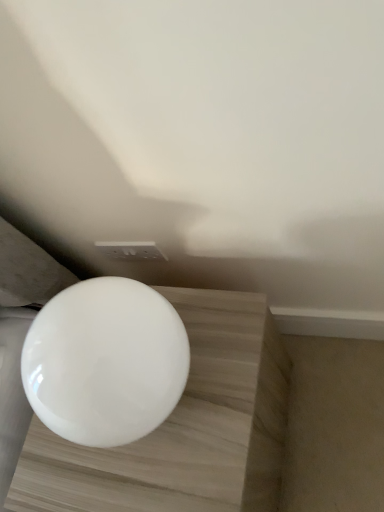
Find the location of a particular element. The height and width of the screenshot is (512, 384). unoccupied region to the right of white glossy toilet at center is located at coordinates (223, 338).